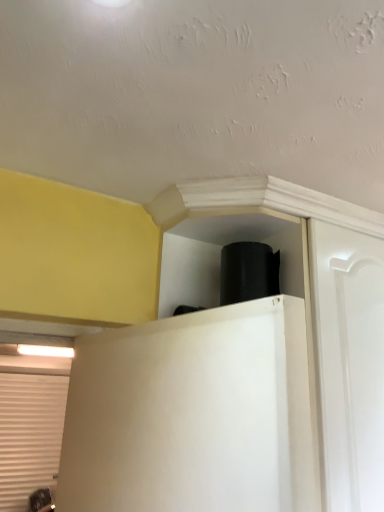
What is the approximate width of white textured blind at lower left?

The width of white textured blind at lower left is 2.20 inches.

Describe the element at coordinates (30, 435) in the screenshot. I see `white textured blind at lower left` at that location.

Image resolution: width=384 pixels, height=512 pixels. In order to click on white textured blind at lower left in this screenshot , I will do `click(30, 435)`.

You are a GUI agent. You are given a task and a screenshot of the screen. Output one action in this format:
    pyautogui.click(x=<x>, y=<y>)
    Task: Click on the white textured blind at lower left
    Image resolution: width=384 pixels, height=512 pixels.
    Given the screenshot: What is the action you would take?
    pyautogui.click(x=30, y=435)